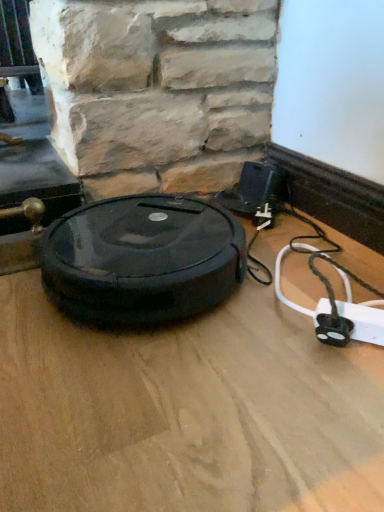
This screenshot has height=512, width=384. I want to click on vacant space behind white plastic extension cord at lower right, so click(314, 277).